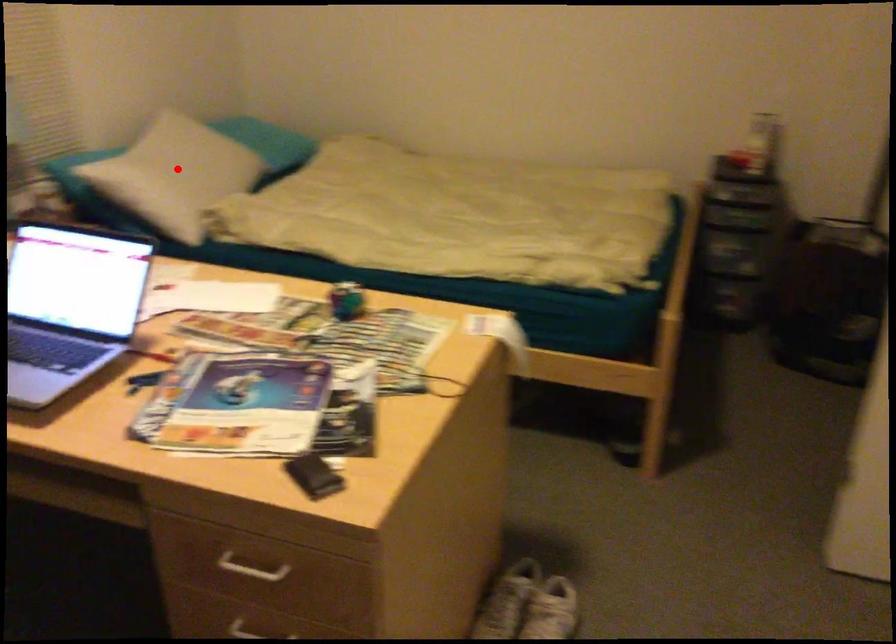
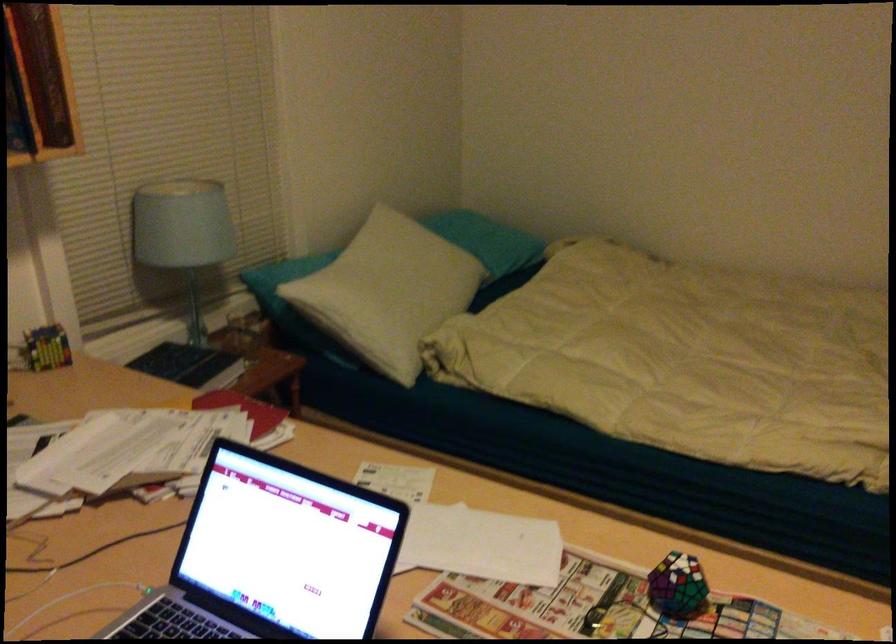
Question: I am providing you with two images of the same scene from different viewpoints. In image1, a red point is highlighted. Considering the same 3D point in image2, which of the following is correct?

Choices:
 (A) It is closer
 (B) It is farther

Answer: (A)